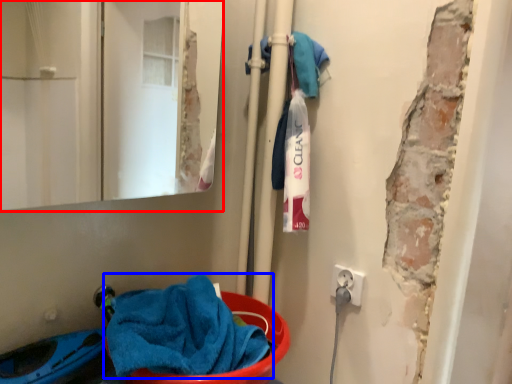
Question: Which object is further to the camera taking this photo, mirror (highlighted by a red box) or towel (highlighted by a blue box)?

Choices:
 (A) mirror
 (B) towel

Answer: (B)